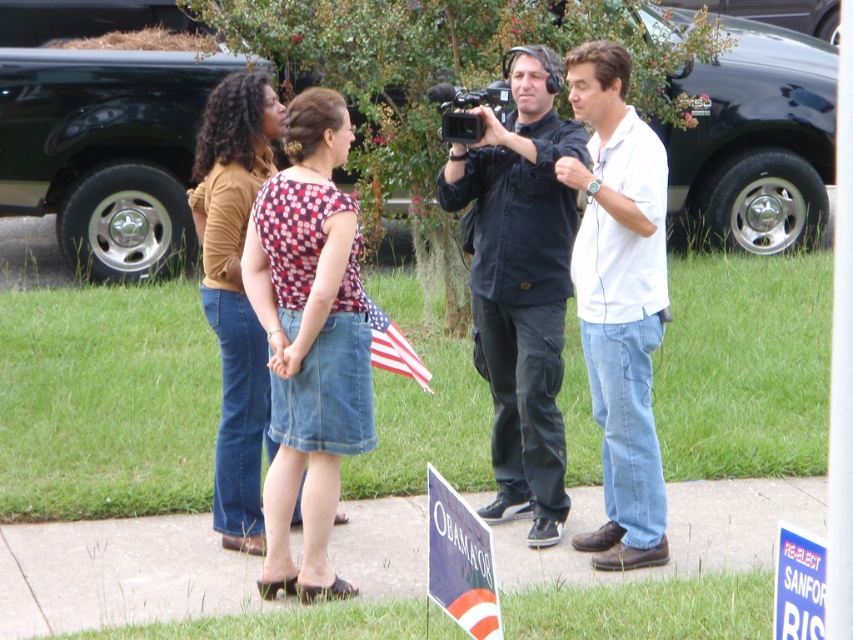
You are a photographer who needs to capture a wide shot of the scene. The camera you are using has a minimum focusing distance of 1.2 meters. Can you take a clear photo of both the black shirt at center and the denim skirt at center without moving the camera?

The black shirt at center is 1.10 meters from the denim skirt at center. Since the camera requires a minimum focusing distance of 1.2 meters, the distance between them is too short. Moving the camera back or using a different lens might be necessary to ensure both are in focus.

You are a photographer at the scene. You need to capture a photo that includes both the white cotton shirt at center and the american flag at center. Which object should you adjust your camera angle to focus on first to ensure both are in frame?

The white cotton shirt at center is much taller than the american flag at center, so you should focus on the white cotton shirt at center first to ensure the entire flag is captured within the frame.

You are a photographer standing at the edge of the sidewalk, and you want to take a photo that includes both the white cotton shirt at center and the american flag at center. Can you position yourself so that both objects are in the frame without moving either object? Explain your reasoning.

The white cotton shirt at center and american flag at center are 3.41 feet apart. Since the distance between them is manageable for a standard camera lens, positioning yourself at an angle that captures both within the frame should be possible without moving the objects.